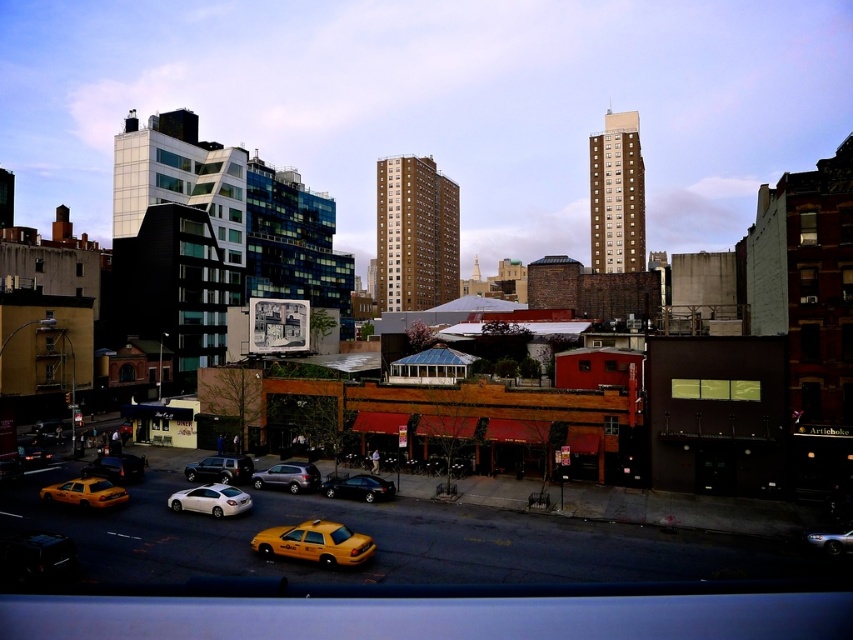
Question: Considering the relative positions of yellow matte taxi at center and white matte sedan at center in the image provided, where is yellow matte taxi at center located with respect to white matte sedan at center?

Choices:
 (A) right
 (B) left

Answer: (A)

Question: Among these points, which one is nearest to the camera?

Choices:
 (A) (349, 486)
 (B) (262, 477)

Answer: (A)

Question: Which object appears closest to the camera in this image?

Choices:
 (A) matte black suv at center
 (B) yellow matte taxi at lower left
 (C) satin silver suv at center

Answer: (B)

Question: Can you confirm if matte black suv at center is positioned to the right of metallic silver car at lower right?

Choices:
 (A) no
 (B) yes

Answer: (A)

Question: Which of the following is the farthest from the observer?

Choices:
 (A) click(x=239, y=496)
 (B) click(x=331, y=486)
 (C) click(x=86, y=496)

Answer: (B)

Question: Does yellow matte taxi at lower left have a lesser width compared to metallic silver car at lower right?

Choices:
 (A) yes
 (B) no

Answer: (B)